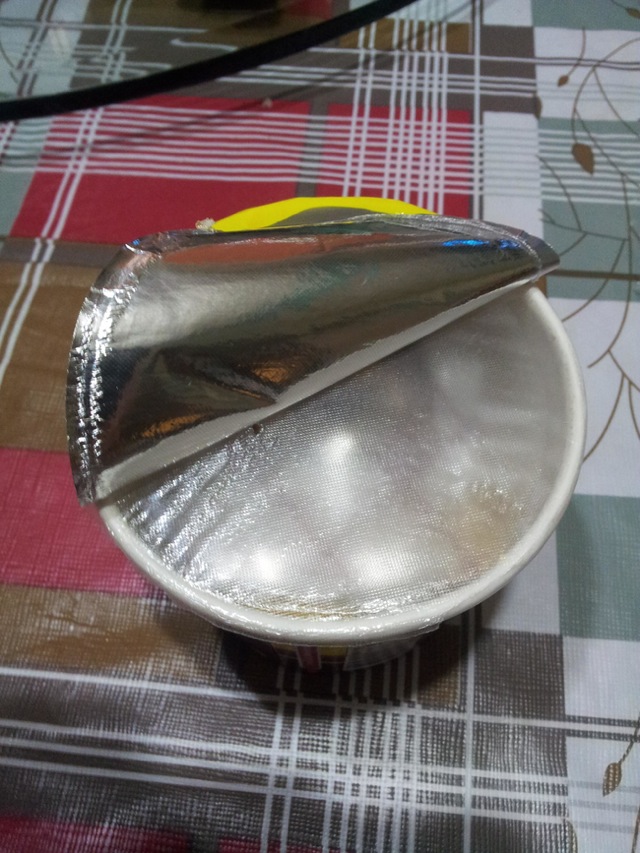
Locate an element on the screen. plastic table cloth is located at coordinates (541, 596).